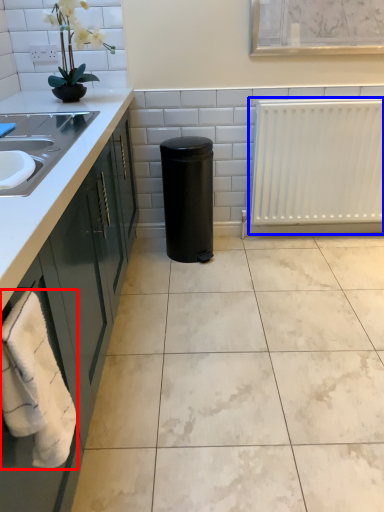
Question: Among these objects, which one is farthest to the camera, bath towel (highlighted by a red box) or radiator (highlighted by a blue box)?

Choices:
 (A) bath towel
 (B) radiator

Answer: (B)